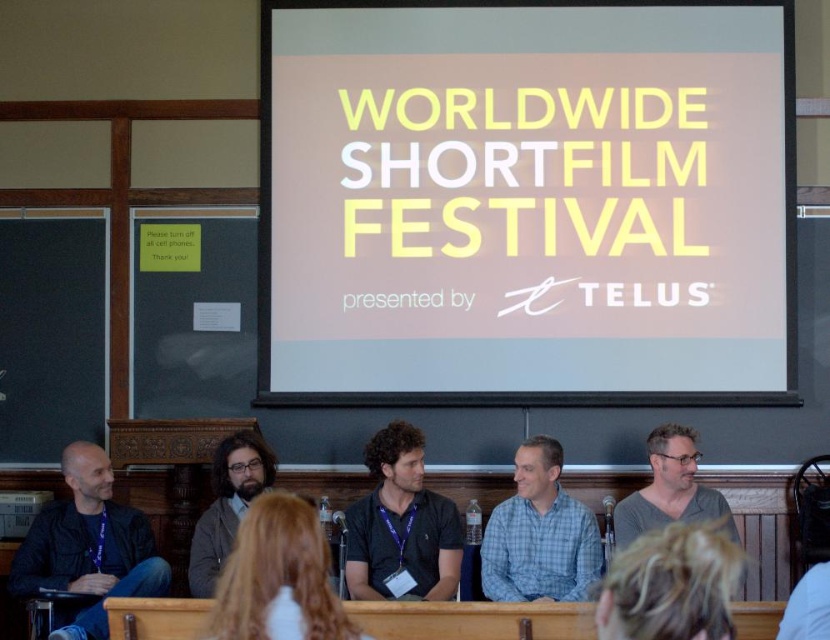
You are a photographer at the event and need to adjust the camera focus. Which of the two shirts at center, the black fabric shirt at center or the blue plaid shirt at center, is taller and requires more focus adjustment?

The black fabric shirt at center is taller than the blue plaid shirt at center, so it requires more focus adjustment.

Looking at this image, you are standing at the point labeled point [370,580] in the image, which is part of a panel discussion at the Worldwide Short Film Festival. You want to take a photo of the panelists and the large screen behind them. If the camera you are using has a focal length of 50mm and the recommended distance for clear photos is at least 6 meters, can you take a clear photo from your current position?

The distance between point [370,580] and the camera is 6.32 meters, which meets the recommended distance of at least 6 meters. Therefore, you can take a clear photo from your current position.